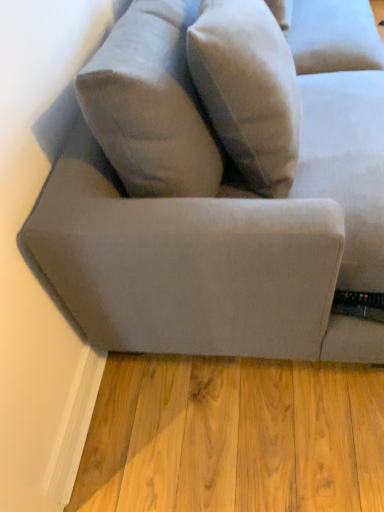
Find the location of a particular element. The width and height of the screenshot is (384, 512). light gray fabric couch at center is located at coordinates (221, 246).

This screenshot has width=384, height=512. What do you see at coordinates (221, 246) in the screenshot?
I see `light gray fabric couch at center` at bounding box center [221, 246].

Identify the location of light gray fabric couch at center. (221, 246).